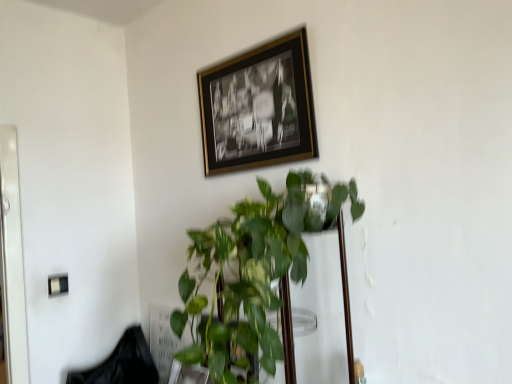
Question: Is green glossy plant at center at the left side of gold-framed photo at upper center?

Choices:
 (A) yes
 (B) no

Answer: (B)

Question: Considering the relative sizes of green glossy plant at center and gold-framed photo at upper center in the image provided, is green glossy plant at center shorter than gold-framed photo at upper center?

Choices:
 (A) no
 (B) yes

Answer: (A)

Question: Is green glossy plant at center taller than gold-framed photo at upper center?

Choices:
 (A) yes
 (B) no

Answer: (A)

Question: Does green glossy plant at center have a larger size compared to gold-framed photo at upper center?

Choices:
 (A) no
 (B) yes

Answer: (B)

Question: Would you say green glossy plant at center is a long distance from gold-framed photo at upper center?

Choices:
 (A) yes
 (B) no

Answer: (B)

Question: From the image's perspective, relative to green glossy plant at center, is gold-framed photo at upper center above or below?

Choices:
 (A) above
 (B) below

Answer: (A)

Question: From a real-world perspective, is gold-framed photo at upper center physically located above or below green glossy plant at center?

Choices:
 (A) above
 (B) below

Answer: (A)

Question: Is point (296, 34) closer or farther from the camera than point (347, 322)?

Choices:
 (A) closer
 (B) farther

Answer: (B)

Question: In the image, is gold-framed photo at upper center positioned in front of or behind green glossy plant at center?

Choices:
 (A) behind
 (B) front

Answer: (A)

Question: From the image's perspective, is green glossy plant at center located above or below black fabric swivel chair at lower left?

Choices:
 (A) above
 (B) below

Answer: (A)

Question: From a real-world perspective, is green glossy plant at center positioned above or below black fabric swivel chair at lower left?

Choices:
 (A) below
 (B) above

Answer: (B)

Question: In the image, is green glossy plant at center on the left side or the right side of black fabric swivel chair at lower left?

Choices:
 (A) left
 (B) right

Answer: (B)

Question: Considering the positions of green glossy plant at center and black fabric swivel chair at lower left in the image, is green glossy plant at center bigger or smaller than black fabric swivel chair at lower left?

Choices:
 (A) small
 (B) big

Answer: (B)

Question: From a real-world perspective, is black fabric swivel chair at lower left positioned above or below green glossy plant at center?

Choices:
 (A) above
 (B) below

Answer: (B)

Question: Does point (125, 339) appear closer or farther from the camera than point (223, 380)?

Choices:
 (A) farther
 (B) closer

Answer: (A)